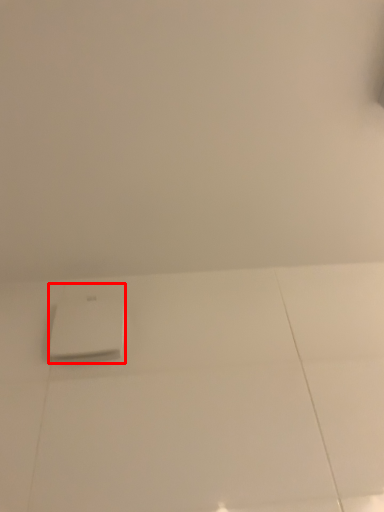
Question: Considering the relative positions of home appliance (annotated by the red box) and backdrop in the image provided, where is home appliance (annotated by the red box) located with respect to the staircase?

Choices:
 (A) left
 (B) right

Answer: (A)